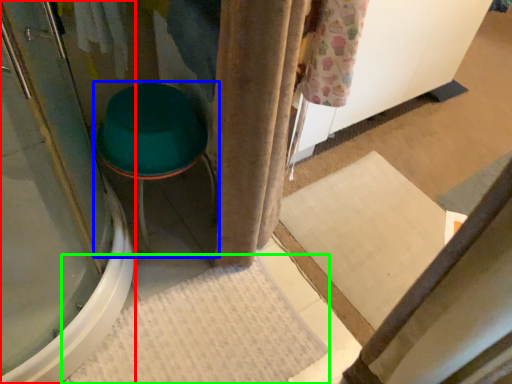
Question: Which is farther away from screen door (highlighted by a red box)? furniture (highlighted by a blue box) or bath mat (highlighted by a green box)?

Choices:
 (A) furniture
 (B) bath mat

Answer: (B)